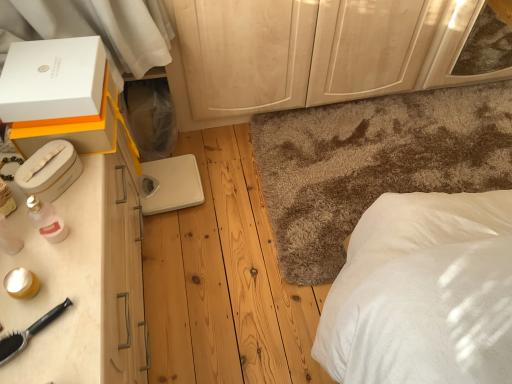
Where is `vacant space in between white plastic box at left, marked as the 1th box in a bottom-to-top arrangement, and pink glass perfume at left`? The height and width of the screenshot is (384, 512). vacant space in between white plastic box at left, marked as the 1th box in a bottom-to-top arrangement, and pink glass perfume at left is located at coordinates (60, 204).